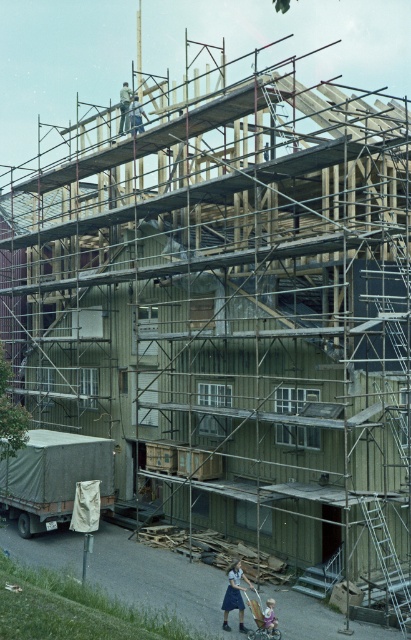
In the scene shown: You are a construction worker who needs to move a tool from the camouflage fabric baby carriage at lower left to the metallic silver ladder at lower right. Which object is closer to you when you start moving the tool?

The camouflage fabric baby carriage at lower left is closer to you since it is positioned further to the viewer than the metallic silver ladder at lower right.

You are a crane operator trying to place a beam on the wooden construction worker at center. What is the exact coordinate where you should aim the crane to place the beam?

The wooden construction worker at center is located at point [235,595], so you should aim the crane at those coordinates to place the beam accurately.

Consider the image. You are a construction worker standing at the entrance of the building. You need to move a heavy tool to the point marked as point [53,476]. Is the camouflage fabric baby carriage at lower left in your way?

The point [53,476] corresponds to the camouflage fabric baby carriage at lower left, so yes, the camouflage fabric baby carriage at lower left is in your way.